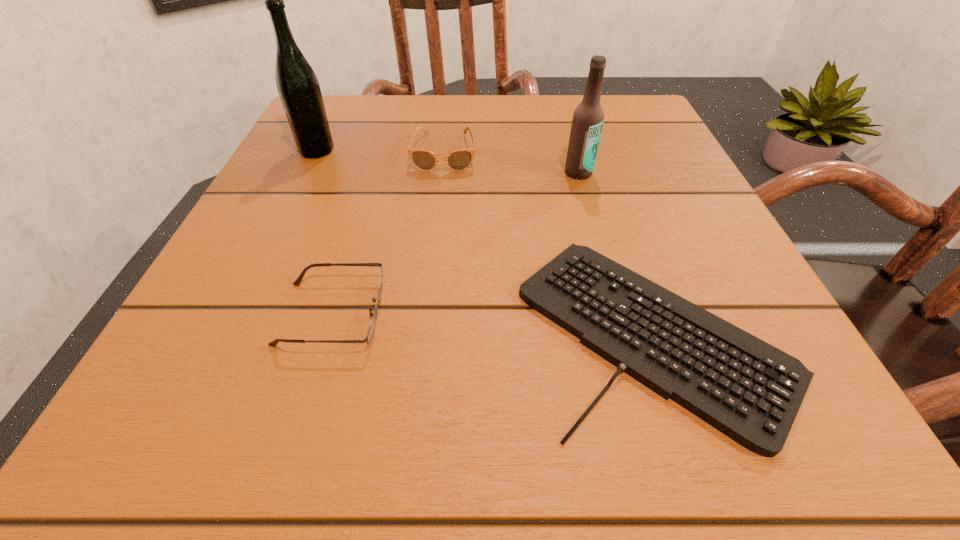
At what (x,y) coordinates should I click in order to perform the action: click on vacant space at the far edge of the desktop. Please return your answer as a coordinate pair (x, y). Looking at the image, I should click on (392, 120).

This screenshot has width=960, height=540. Find the location of `vacant region at the near edge of the desktop`. vacant region at the near edge of the desktop is located at coordinates (347, 399).

The image size is (960, 540). I want to click on blank space at the left edge of the desktop, so click(300, 176).

In the image, there is a desktop. Where is `free space at the right edge`? This screenshot has height=540, width=960. free space at the right edge is located at coordinates (676, 259).

This screenshot has height=540, width=960. I want to click on vacant space at the far left corner, so click(x=362, y=120).

This screenshot has width=960, height=540. I want to click on vacant area that lies between the second shortest object and the computer keyboard, so click(493, 322).

This screenshot has width=960, height=540. In order to click on unoccupied area between the fourth tallest object and the sunglasses in this screenshot , I will do `click(388, 233)`.

At what (x,y) coordinates should I click in order to perform the action: click on vacant area between the leftmost object and the spectacles. Please return your answer as a coordinate pair (x, y). The image size is (960, 540). Looking at the image, I should click on (324, 232).

Where is `vacant point located between the shorter beer bottle and the sunglasses`? vacant point located between the shorter beer bottle and the sunglasses is located at coordinates (512, 163).

In order to click on vacant space that is in between the farther beer bottle and the shortest object in this screenshot , I will do `click(485, 241)`.